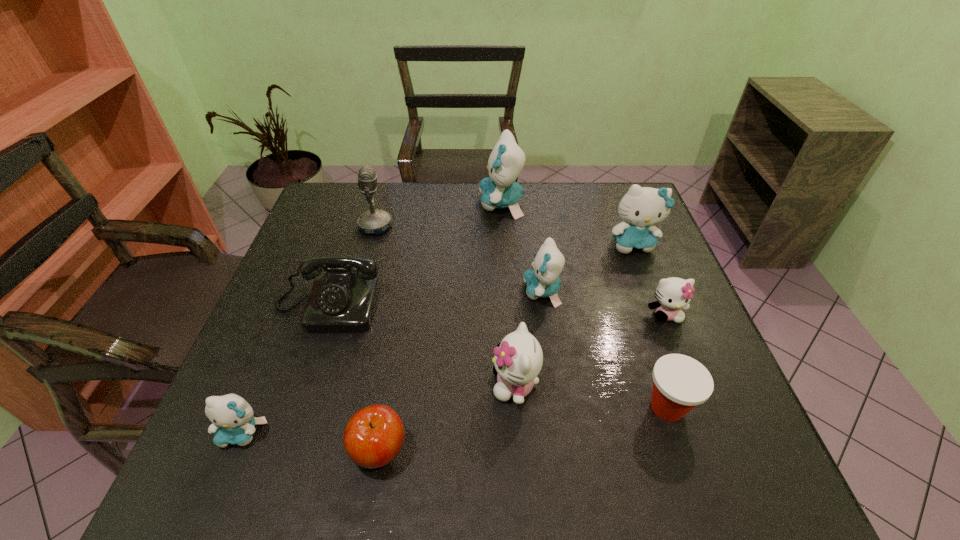
The width and height of the screenshot is (960, 540). I want to click on the smaller white kitten, so click(673, 293).

What are the coordinates of `the smallest blue kitten` in the screenshot? It's located at (233, 422).

At what (x,y) coordinates should I click in order to perform the action: click on the nearest kitten. Please return your answer as a coordinate pair (x, y). Looking at the image, I should click on (233, 422).

The width and height of the screenshot is (960, 540). I want to click on apple, so click(373, 437).

Where is `red-orange Dixie cup`? This screenshot has height=540, width=960. red-orange Dixie cup is located at coordinates (680, 383).

Identify the location of vacant area situated 0.130m on the face of the biggest blue kitten. The width and height of the screenshot is (960, 540). (439, 204).

You are a GUI agent. You are given a task and a screenshot of the screen. Output one action in this format:
    pyautogui.click(x=<x>, y=<y>)
    Task: Click on the vacant region located on the face of the biggest blue kitten
    This screenshot has width=960, height=540.
    Given the screenshot: What is the action you would take?
    pyautogui.click(x=362, y=204)

Where is `vacant area situated on the face of the biggest blue kitten`? vacant area situated on the face of the biggest blue kitten is located at coordinates (373, 204).

Locate an element on the screen. vacant space located on the front-facing side of the microphone is located at coordinates (448, 226).

What are the coordinates of `blank space located 0.210m on the face of the second farthest kitten` in the screenshot? It's located at (660, 314).